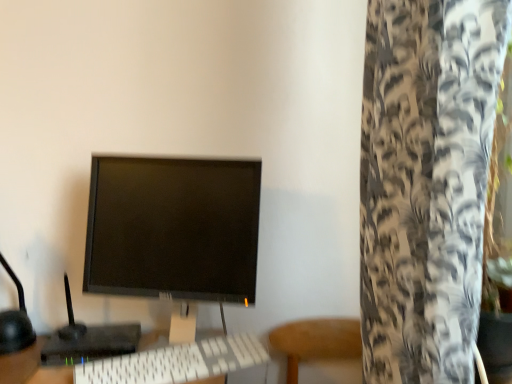
Question: Does white plastic keyboard at center have a lesser height compared to black plastic monitor at center?

Choices:
 (A) no
 (B) yes

Answer: (B)

Question: Considering the relative positions of white plastic keyboard at center and black plastic monitor at center in the image provided, is white plastic keyboard at center to the left of black plastic monitor at center from the viewer's perspective?

Choices:
 (A) no
 (B) yes

Answer: (A)

Question: Would you say white plastic keyboard at center is outside black plastic monitor at center?

Choices:
 (A) yes
 (B) no

Answer: (A)

Question: Considering the relative positions of white plastic keyboard at center and black plastic monitor at center in the image provided, is white plastic keyboard at center to the right of black plastic monitor at center from the viewer's perspective?

Choices:
 (A) no
 (B) yes

Answer: (B)

Question: From a real-world perspective, does white plastic keyboard at center stand above black plastic monitor at center?

Choices:
 (A) no
 (B) yes

Answer: (A)

Question: Is white plastic keyboard at center oriented away from black plastic monitor at center?

Choices:
 (A) yes
 (B) no

Answer: (B)

Question: Does white plastic keyboard at center touch white textured curtain at right?

Choices:
 (A) no
 (B) yes

Answer: (A)

Question: Can you confirm if white plastic keyboard at center is smaller than white textured curtain at right?

Choices:
 (A) yes
 (B) no

Answer: (A)

Question: Are white plastic keyboard at center and white textured curtain at right located far from each other?

Choices:
 (A) yes
 (B) no

Answer: (B)

Question: Considering the relative sizes of white plastic keyboard at center and white textured curtain at right in the image provided, is white plastic keyboard at center shorter than white textured curtain at right?

Choices:
 (A) no
 (B) yes

Answer: (B)

Question: Is white plastic keyboard at center wider than white textured curtain at right?

Choices:
 (A) no
 (B) yes

Answer: (A)

Question: Is white plastic keyboard at center positioned before white textured curtain at right?

Choices:
 (A) no
 (B) yes

Answer: (A)

Question: Considering the relative sizes of white plastic keyboard at center and black matte monitor at center in the image provided, is white plastic keyboard at center wider than black matte monitor at center?

Choices:
 (A) no
 (B) yes

Answer: (A)